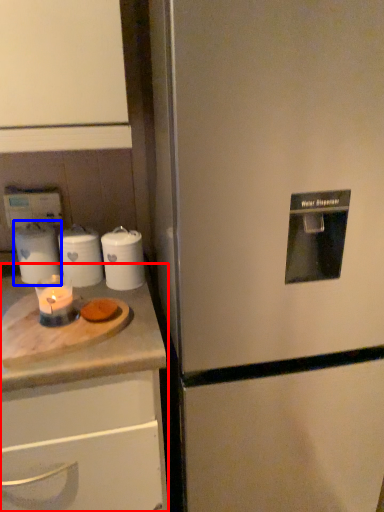
Question: Which point is closer to the camera, counter (highlighted by a red box) or appliance (highlighted by a blue box)?

Choices:
 (A) counter
 (B) appliance

Answer: (A)